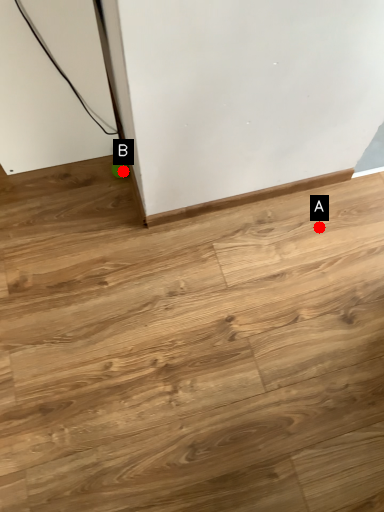
Question: Two points are circled on the image, labeled by A and B beside each circle. Which point is closer to the camera?

Choices:
 (A) A is closer
 (B) B is closer

Answer: (A)